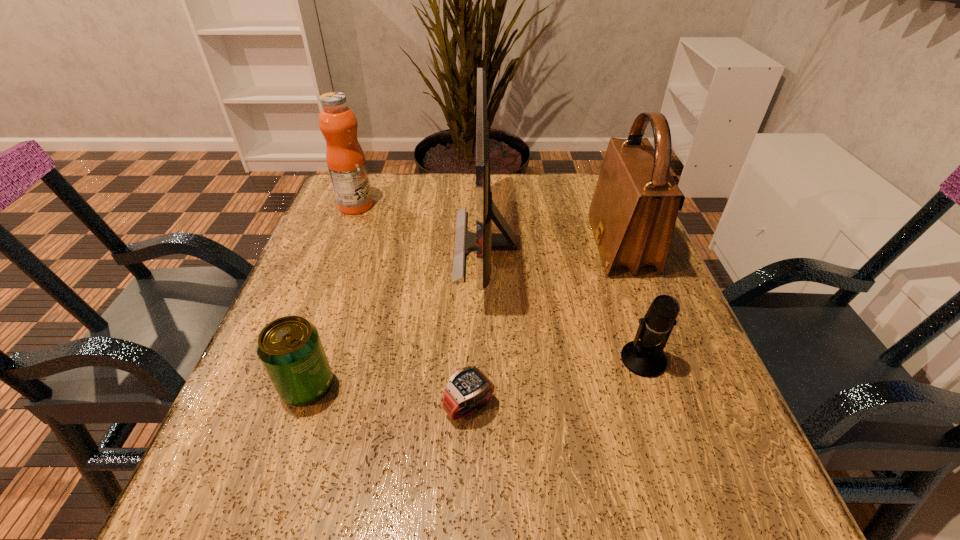
This screenshot has height=540, width=960. I want to click on monitor, so click(x=483, y=241).

Locate an element on the screen. The height and width of the screenshot is (540, 960). shoulder bag is located at coordinates (633, 212).

Where is `fruit juice`? The image size is (960, 540). fruit juice is located at coordinates (345, 158).

Where is `microphone`? The width and height of the screenshot is (960, 540). microphone is located at coordinates (642, 357).

Find the location of `beer can`. beer can is located at coordinates (290, 349).

The width and height of the screenshot is (960, 540). Find the location of `watch`. watch is located at coordinates (468, 389).

Where is `vacant area situated on the screen side of the monitor`? vacant area situated on the screen side of the monitor is located at coordinates (310, 245).

This screenshot has height=540, width=960. I want to click on vacant space situated on the screen side of the monitor, so 345,245.

Locate an element on the screen. The height and width of the screenshot is (540, 960). vacant space situated on the screen side of the monitor is located at coordinates (394, 245).

Locate an element on the screen. free space located 0.070m on the front flap of the shoulder bag is located at coordinates (563, 246).